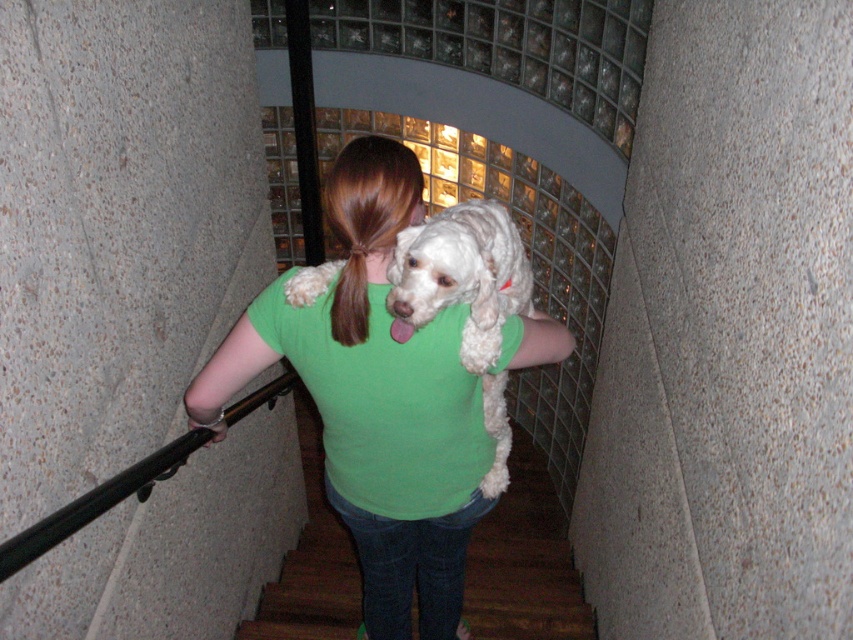
You are designing a new outfit for the person in the image. The outfit must include both the green cotton shirt at center and the white fluffy dog at center. If the shirt is wider than the dog, how should you arrange them to ensure the shirt doesn not cover the dog?

Since the green cotton shirt at center is wider than the white fluffy dog at center, you can position the dog to the side of the shirt, ensuring that the shirt does not cover the dog by utilizing its wider width to frame the dog appropriately.

You are a photographer trying to capture a candid shot of the person and their dog. Since you want to ensure both are in focus, you need to know their positions relative to each other. According to the scene, is the white fluffy dog at center closer to you or farther away compared to the green cotton shirt at center?

The white fluffy dog at center is behind the green cotton shirt at center, so it is farther away from you compared to the green cotton shirt at center.